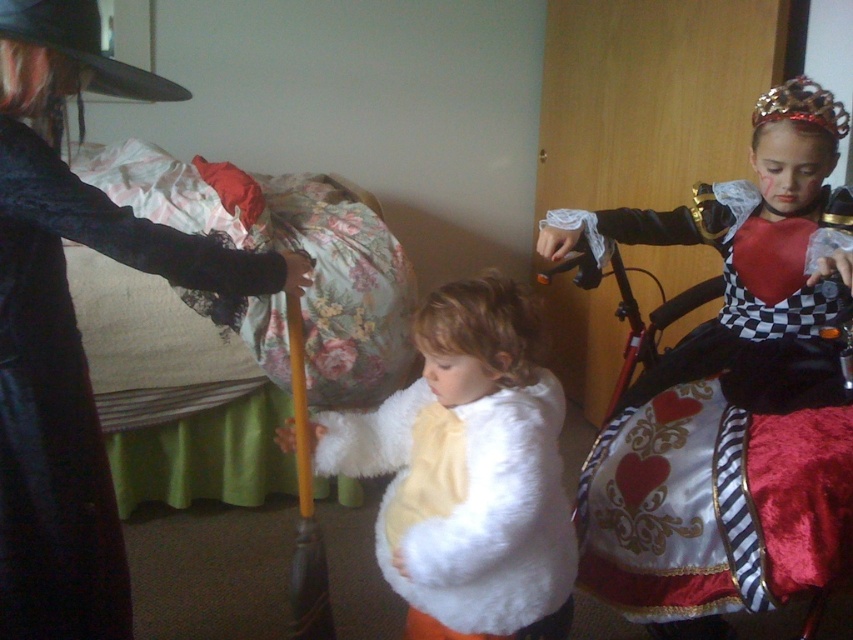
You are standing in the room and want to hand a gift to the person wearing the white fluffy vest at center without disturbing the person with the matte black coat at left. How can you approach them?

The matte black coat at left is in front of the white fluffy vest at center, so you should go around the matte black coat at left to reach the white fluffy vest at center without disturbing them.